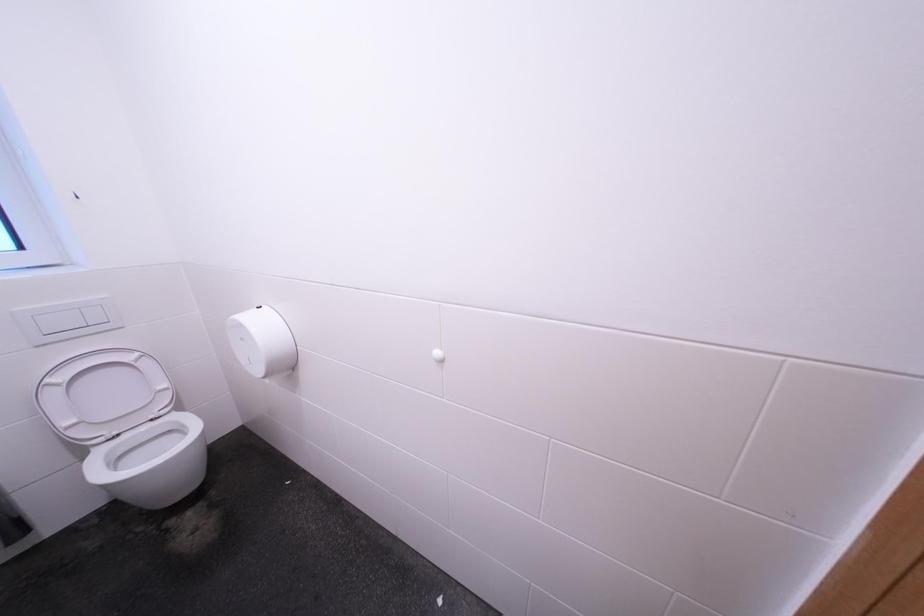
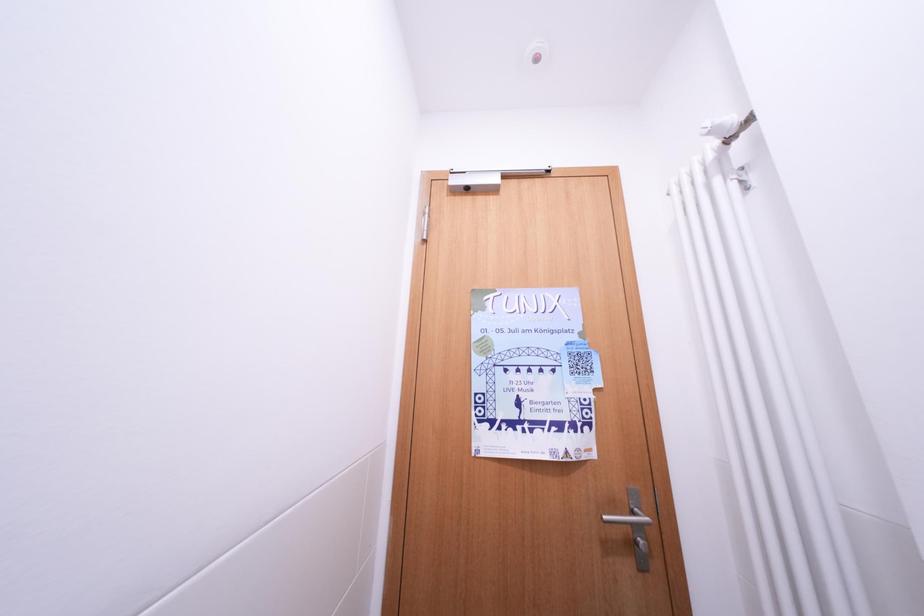
Question: Based on the continuous images, in which direction is the camera rotating? Reply with the corresponding letter.

Choices:
 (A) Left
 (B) Right
 (C) Up
 (D) Down

Answer: (B)